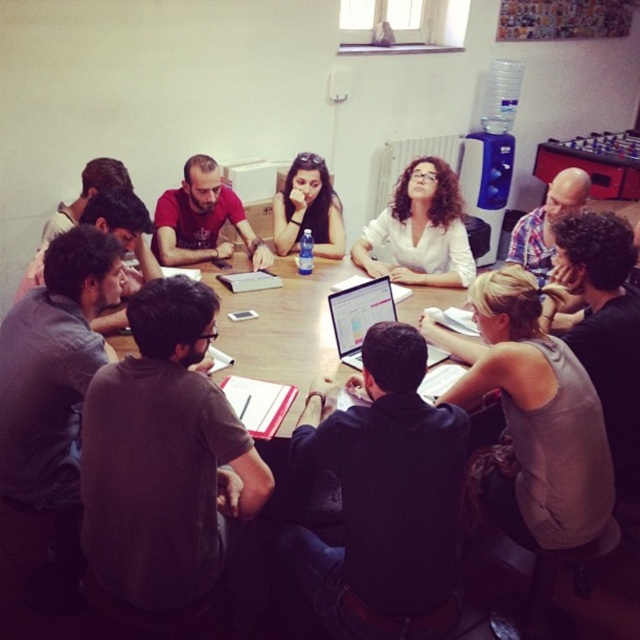
Question: Is dark gray t-shirt at lower left bigger than bald man in plaid shirt at upper right?

Choices:
 (A) no
 (B) yes

Answer: (B)

Question: Which of these objects is positioned closest to the bald man in plaid shirt at upper right?

Choices:
 (A) matte red shirt at center
 (B) matte black hair at center
 (C) dark gray t-shirt at lower left
 (D) silver metallic laptop at center

Answer: (D)

Question: Is matte red shirt at center positioned behind matte black hair at center?

Choices:
 (A) no
 (B) yes

Answer: (A)

Question: Considering the real-world distances, which object is closest to the gray sleeveless top at lower right?

Choices:
 (A) bald man in plaid shirt at upper right
 (B) white glossy shirt at upper center

Answer: (A)

Question: In this image, where is gray sleeveless top at lower right located relative to matte black hair at center?

Choices:
 (A) left
 (B) right

Answer: (B)

Question: Which object is the farthest from the gray sleeveless top at lower right?

Choices:
 (A) matte red shirt at center
 (B) dark gray t-shirt at lower left
 (C) matte black hair at center
 (D) bald man in plaid shirt at upper right

Answer: (A)